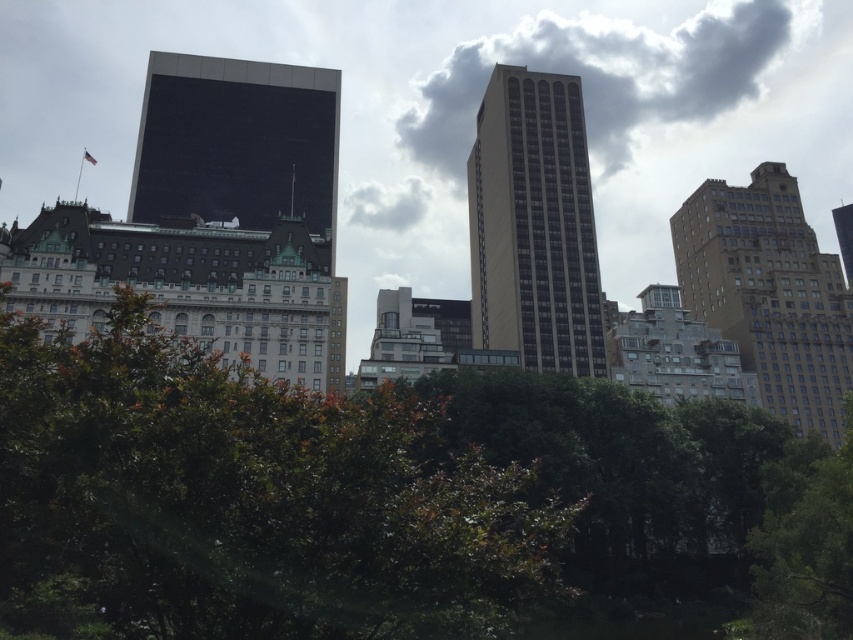
You are an urban planner analyzing the image. You need to determine the relative sizes of the green leafy bush at lower center and the cloudy sky at upper center. Which object is smaller?

The green leafy bush at lower center is smaller compared to the cloudy sky at upper center.